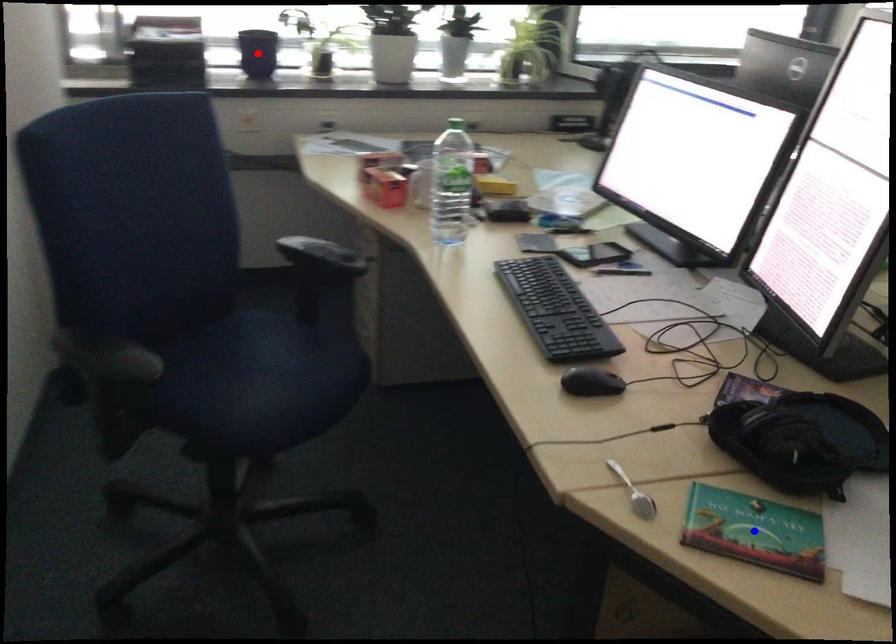
Question: In the image, two points are highlighted. Which point is nearer to the camera? Reply with the corresponding letter.

Choices:
 (A) blue point
 (B) red point

Answer: (A)